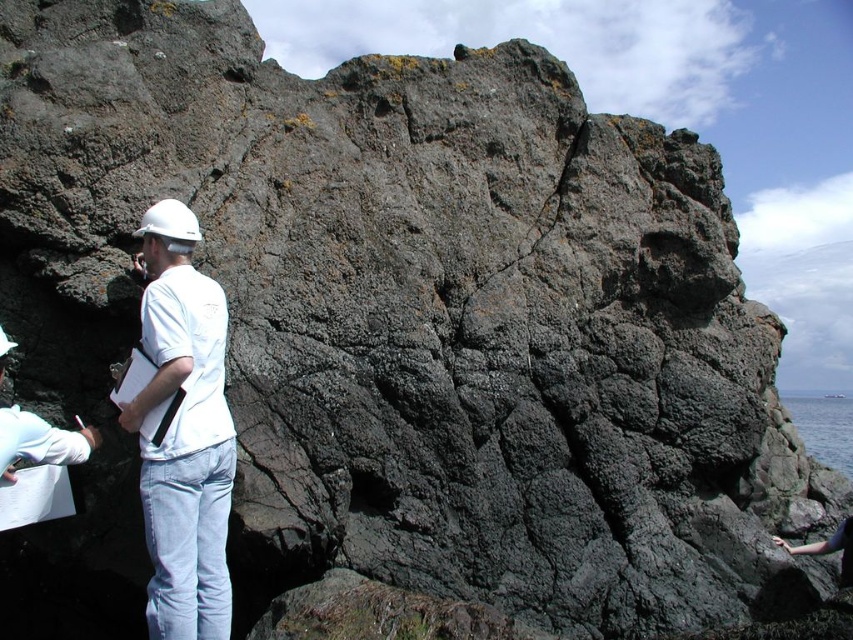
Question: Can you confirm if white matte hard hat at left is wider than blue liquid water at lower right?

Choices:
 (A) yes
 (B) no

Answer: (B)

Question: Estimate the real-world distances between objects in this image. Which object is closer to the blue liquid water at lower right?

Choices:
 (A) white matte hard hat at left
 (B) white matte helmet at left

Answer: (B)

Question: Which point is closer to the camera?

Choices:
 (A) white matte hard hat at left
 (B) white matte helmet at left

Answer: (B)

Question: From the image, what is the correct spatial relationship of white matte hard hat at left in relation to blue liquid water at lower right?

Choices:
 (A) above
 (B) below

Answer: (A)

Question: Based on their relative distances, which object is farther from the white matte hard hat at left?

Choices:
 (A) blue liquid water at lower right
 (B) white matte helmet at left

Answer: (A)

Question: Is white matte helmet at left positioned before white matte hard hat at left?

Choices:
 (A) no
 (B) yes

Answer: (B)